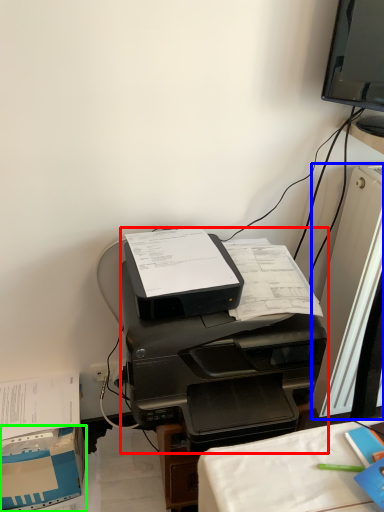
Question: Which object is positioned closest to printer (highlighted by a red box)? Select from desktop computer (highlighted by a blue box) and cardboard box (highlighted by a green box).

Choices:
 (A) desktop computer
 (B) cardboard box

Answer: (A)